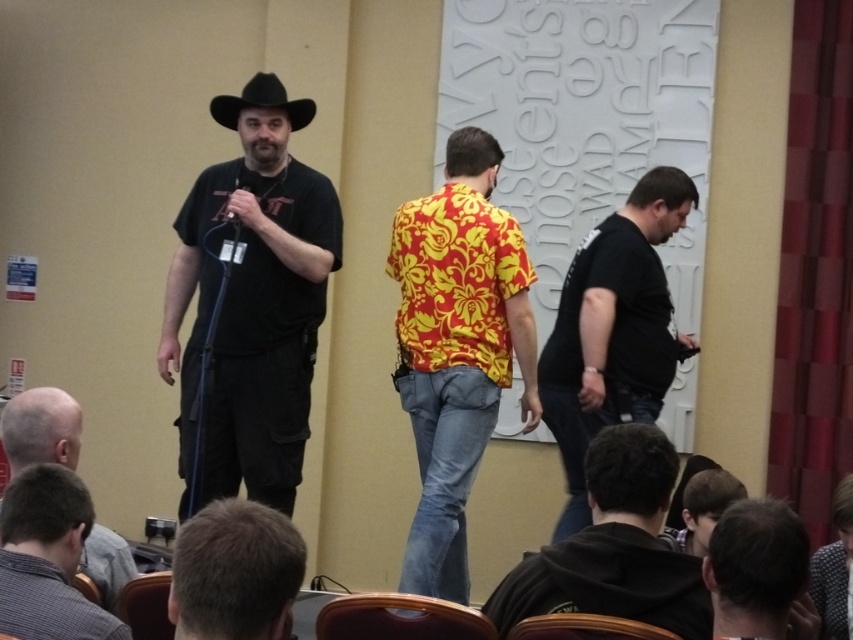
Is floral print shirt at center bigger than brown leather chair at lower left?

Indeed, floral print shirt at center has a larger size compared to brown leather chair at lower left.

Which is more to the right, floral print shirt at center or brown leather chair at lower left?

Positioned to the right is floral print shirt at center.

Identify the location of floral print shirt at center. The image size is (853, 640). (457, 348).

Between point (235, 570) and point (103, 589), which one is positioned in front?

Positioned in front is point (235, 570).

Is short hair at lower left taller than bald head at lower left?

Yes.

What do you see at coordinates (235, 572) in the screenshot? I see `short hair at lower left` at bounding box center [235, 572].

You are a GUI agent. You are given a task and a screenshot of the screen. Output one action in this format:
    pyautogui.click(x=<x>, y=<y>)
    Task: Click on the short hair at lower left
    
    Given the screenshot: What is the action you would take?
    pyautogui.click(x=235, y=572)

Between black matte shirt at center and black hoodie at lower center, which one has less height?

black hoodie at lower center

Is point (619, 308) positioned in front of point (634, 580)?

No, (619, 308) is behind (634, 580).

Does point (648, 273) come closer to viewer compared to point (651, 502)?

That is False.

The height and width of the screenshot is (640, 853). What are the coordinates of `black matte shirt at center` in the screenshot? It's located at (613, 330).